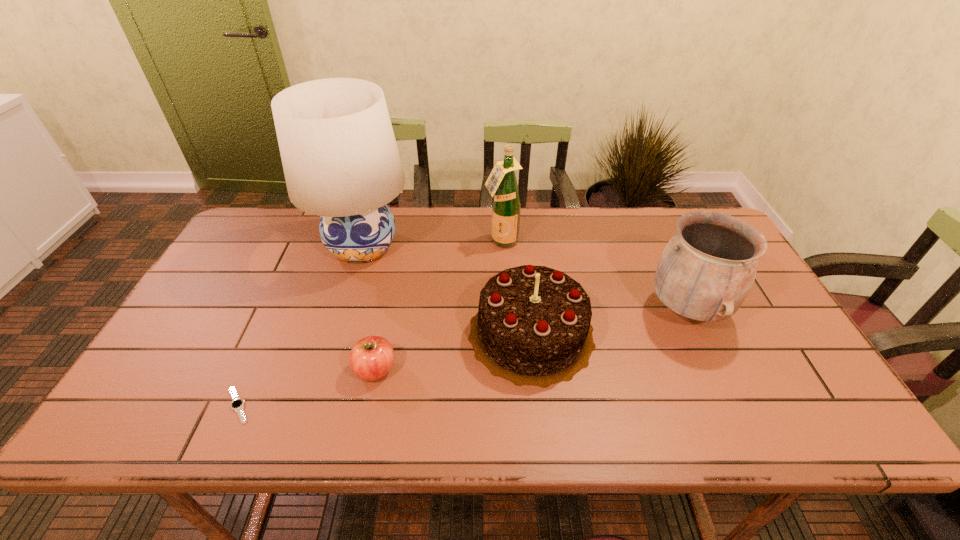
Identify the location of vacant space located 0.180m on the left of the birthday cake. (398, 333).

What are the coordinates of `free region located on the back of the apple` in the screenshot? It's located at (395, 279).

The height and width of the screenshot is (540, 960). Find the location of `blank space located on the back of the watch`. blank space located on the back of the watch is located at coordinates (255, 366).

Locate an element on the screen. lampshade located at the far edge is located at coordinates (340, 159).

Identify the location of liquor at the far edge. The height and width of the screenshot is (540, 960). (502, 183).

Where is `object that is at the near edge`? The image size is (960, 540). object that is at the near edge is located at coordinates (237, 404).

I want to click on object that is positioned at the right edge, so click(706, 271).

The width and height of the screenshot is (960, 540). Identify the location of vacant region at the far edge. pyautogui.click(x=467, y=251).

The image size is (960, 540). What are the coordinates of `vacant area at the near edge` in the screenshot? It's located at (610, 411).

Image resolution: width=960 pixels, height=540 pixels. In order to click on vacant space at the left edge of the desktop in this screenshot , I will do `click(249, 269)`.